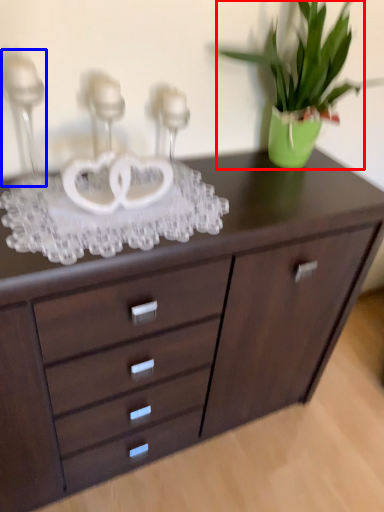
Question: Which object is closer to the camera taking this photo, houseplant (highlighted by a red box) or candle holder (highlighted by a blue box)?

Choices:
 (A) houseplant
 (B) candle holder

Answer: (B)